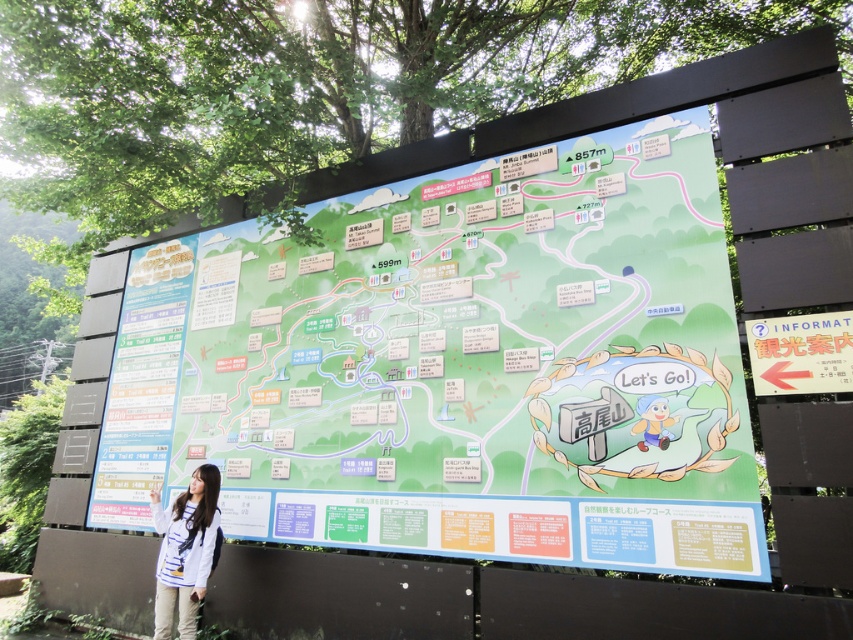
Question: Which object is positioned closest to the white striped shirt at lower left?

Choices:
 (A) matte red sign at right
 (B) green paper map at center

Answer: (B)

Question: Does green paper map at center appear over matte red sign at right?

Choices:
 (A) yes
 (B) no

Answer: (B)

Question: Considering the real-world distances, which object is closest to the white striped shirt at lower left?

Choices:
 (A) matte red sign at right
 (B) green paper map at center

Answer: (B)

Question: Where is white striped shirt at lower left located in relation to matte red sign at right in the image?

Choices:
 (A) left
 (B) right

Answer: (A)

Question: Is green paper map at center positioned in front of white striped shirt at lower left?

Choices:
 (A) yes
 (B) no

Answer: (A)

Question: Which of the following is the farthest from the observer?

Choices:
 (A) matte red sign at right
 (B) green paper map at center
 (C) white striped shirt at lower left

Answer: (C)